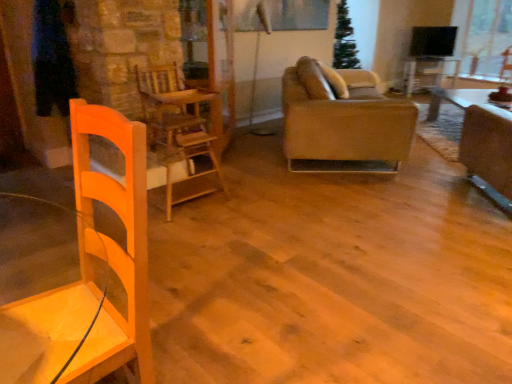
You are a GUI agent. You are given a task and a screenshot of the screen. Output one action in this format:
    pyautogui.click(x=<x>, y=<y>)
    Task: Click on the wooden table at center
    
    Given the screenshot: What is the action you would take?
    pyautogui.click(x=428, y=73)

This screenshot has width=512, height=384. Describe the element at coordinates (176, 127) in the screenshot. I see `wooden chair at center` at that location.

Describe the element at coordinates (343, 121) in the screenshot. I see `leather couch at center` at that location.

Locate an element on the screen. The height and width of the screenshot is (384, 512). wooden table at center is located at coordinates (428, 73).

Considering their positions, is matte glass window screen at upper center located in front of or behind leather couch at center?

matte glass window screen at upper center is positioned farther from the viewer than leather couch at center.

Is matte glass window screen at upper center bigger than leather couch at center?

Incorrect, matte glass window screen at upper center is not larger than leather couch at center.

Based on the photo, is matte glass window screen at upper center not within leather couch at center?

Yes, matte glass window screen at upper center is located beyond the bounds of leather couch at center.

From a real-world perspective, which object stands above the other?

From a 3D spatial view, leather couch at center is above.

Can you confirm if wooden table at center is smaller than leather couch at center?

Indeed, wooden table at center has a smaller size compared to leather couch at center.

Is wooden table at center oriented away from leather couch at center?

wooden table at center does not have its back to leather couch at center.

Between matte glass window screen at upper center and wooden chair at center, which one is positioned behind?

matte glass window screen at upper center is behind.

Which is more to the right, matte glass window screen at upper center or wooden chair at center?

Positioned to the right is matte glass window screen at upper center.

From the image's perspective, does matte glass window screen at upper center appear higher than wooden chair at center?

Yes, from the image's perspective, matte glass window screen at upper center is over wooden chair at center.

Does matte glass window screen at upper center contain wooden chair at center?

No, wooden chair at center is not a part of matte glass window screen at upper center.

How far apart are wooden table at center and matte glass window screen at upper center?

wooden table at center and matte glass window screen at upper center are 2.11 meters apart from each other.

Based on the photo, looking at the image, does wooden table at center seem bigger or smaller compared to matte glass window screen at upper center?

wooden table at center is bigger than matte glass window screen at upper center.

Considering the positions of objects wooden table at center and matte glass window screen at upper center in the image provided, who is more to the left, wooden table at center or matte glass window screen at upper center?

matte glass window screen at upper center is more to the left.

Is point (429, 58) less distant than point (258, 15)?

No.

Which object is wider, wooden table at center or wooden chair at center?

With larger width is wooden chair at center.

From their relative heights in the image, would you say wooden table at center is taller or shorter than wooden chair at center?

wooden table at center is shorter than wooden chair at center.

Is wooden table at center not near wooden chair at center?

Absolutely, wooden table at center is distant from wooden chair at center.

Which is farther from the camera, (408, 80) or (158, 156)?

The point (408, 80) is behind.

Locate an element on the screen. window screen behind the wooden chair at center is located at coordinates (281, 15).

Which of these two, wooden chair at center or matte glass window screen at upper center, stands taller?

With more height is wooden chair at center.

Which object is positioned more to the right, wooden chair at center or matte glass window screen at upper center?

matte glass window screen at upper center is more to the right.

Is wooden chair at center outside of matte glass window screen at upper center?

wooden chair at center is positioned outside matte glass window screen at upper center.

How different are the orientations of wooden chair at center and wooden table at center in degrees?

They differ by 31.1 degrees in their facing directions.

Locate an element on the screen. This screenshot has width=512, height=384. chair lying below the wooden table at center (from the image's perspective) is located at coordinates (176, 127).

Does wooden chair at center appear on the left side of wooden table at center?

Yes.

Locate an element on the screen. window screen above the leather couch at center (from the image's perspective) is located at coordinates (281, 15).

Where is `studio couch below the wooden table at center (from the image's perspective)`? This screenshot has height=384, width=512. studio couch below the wooden table at center (from the image's perspective) is located at coordinates (343, 121).

Estimate the real-world distances between objects in this image. Which object is further from wooden table at center, leather couch at center or matte glass window screen at upper center?

leather couch at center.

Which object lies nearer to the anchor point wooden chair at center, wooden table at center or leather couch at center?

leather couch at center lies closer to wooden chair at center than the other object.

Looking at the image, which one is located further to matte glass window screen at upper center, leather couch at center or wooden table at center?

wooden table at center is further to matte glass window screen at upper center.

Considering their positions, is leather couch at center positioned closer to matte glass window screen at upper center than wooden chair at center?

Among the two, leather couch at center is located nearer to matte glass window screen at upper center.

When comparing their distances from wooden table at center, does matte glass window screen at upper center or leather couch at center seem closer?

The object closer to wooden table at center is matte glass window screen at upper center.

Looking at the image, which one is located closer to wooden table at center, matte glass window screen at upper center or wooden chair at center?

matte glass window screen at upper center is closer to wooden table at center.

Looking at the image, which one is located further to matte glass window screen at upper center, wooden table at center or leather couch at center?

wooden table at center.

From the picture: Looking at the image, which one is located further to wooden chair at center, wooden table at center or matte glass window screen at upper center?

wooden table at center.

Where is `window screen between leather couch at center and wooden table at center along the z-axis`? window screen between leather couch at center and wooden table at center along the z-axis is located at coordinates (281, 15).

Identify the location of studio couch between wooden chair at center and wooden table at center from front to back. coord(343,121).

The image size is (512, 384). I want to click on studio couch positioned between wooden chair at center and matte glass window screen at upper center from near to far, so click(x=343, y=121).

The height and width of the screenshot is (384, 512). Find the location of `window screen between wooden chair at center and wooden table at center from front to back`. window screen between wooden chair at center and wooden table at center from front to back is located at coordinates (281, 15).